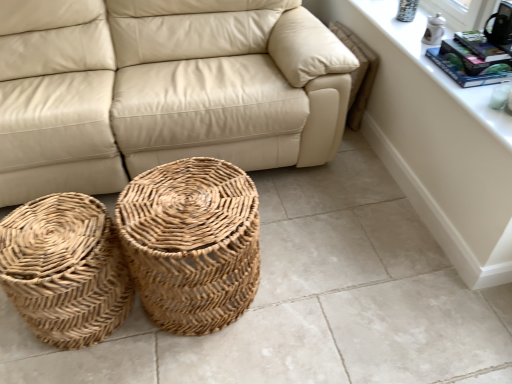
Locate an element on the screen. Image resolution: width=512 pixels, height=384 pixels. free spot above natural woven basket at lower left, the second basket from the right (from a real-world perspective) is located at coordinates (46, 240).